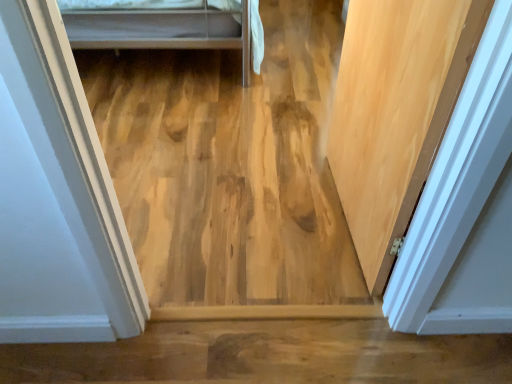
Question: Is natural wood door at right at the left side of natural wood plywood at center?

Choices:
 (A) no
 (B) yes

Answer: (A)

Question: Does natural wood door at right have a greater width compared to natural wood plywood at center?

Choices:
 (A) no
 (B) yes

Answer: (A)

Question: Is natural wood door at right facing towards natural wood plywood at center?

Choices:
 (A) yes
 (B) no

Answer: (B)

Question: From the image's perspective, is natural wood door at right located above natural wood plywood at center?

Choices:
 (A) yes
 (B) no

Answer: (B)

Question: Is natural wood door at right positioned with its back to natural wood plywood at center?

Choices:
 (A) yes
 (B) no

Answer: (B)

Question: Does natural wood door at right have a lesser height compared to natural wood plywood at center?

Choices:
 (A) no
 (B) yes

Answer: (A)

Question: Considering the relative sizes of natural wood plywood at center and natural wood door at right in the image provided, is natural wood plywood at center wider than natural wood door at right?

Choices:
 (A) no
 (B) yes

Answer: (B)

Question: From the image's perspective, is natural wood plywood at center located above natural wood door at right?

Choices:
 (A) yes
 (B) no

Answer: (A)

Question: Is natural wood plywood at center smaller than natural wood door at right?

Choices:
 (A) yes
 (B) no

Answer: (B)

Question: Is natural wood plywood at center not within natural wood door at right?

Choices:
 (A) yes
 (B) no

Answer: (A)

Question: Are natural wood plywood at center and natural wood door at right making contact?

Choices:
 (A) no
 (B) yes

Answer: (A)

Question: Does natural wood plywood at center have a greater height compared to natural wood door at right?

Choices:
 (A) no
 (B) yes

Answer: (A)

Question: Is natural wood door at right wider or thinner than natural wood plywood at center?

Choices:
 (A) wide
 (B) thin

Answer: (B)